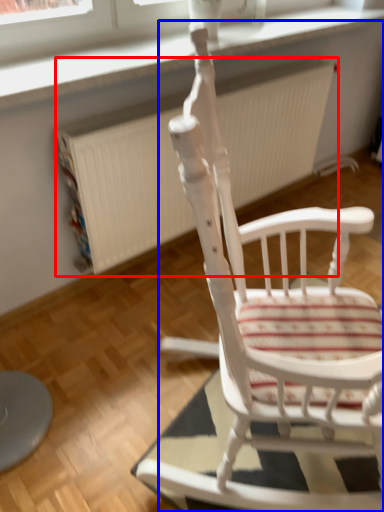
Question: Which of the following is the closest to the observer, radiator (highlighted by a red box) or chair (highlighted by a blue box)?

Choices:
 (A) radiator
 (B) chair

Answer: (B)